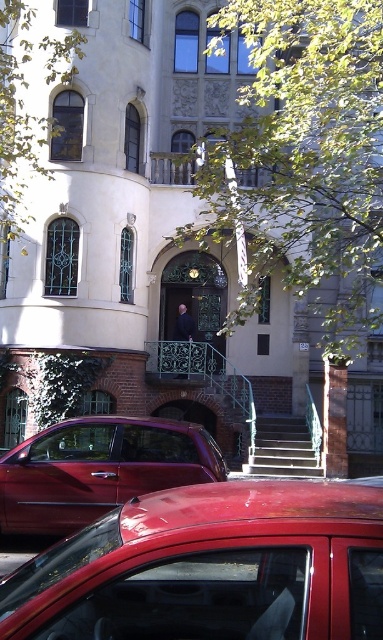
Is shiny metallic car at lower left wider than metallic gray stairs at center?

Yes, shiny metallic car at lower left is wider than metallic gray stairs at center.

Who is taller, shiny metallic car at lower left or metallic gray stairs at center?

Standing taller between the two is shiny metallic car at lower left.

Is point (86, 516) farther from camera compared to point (288, 458)?

No.

I want to click on shiny metallic car at lower left, so click(98, 468).

Describe the element at coordinates (98, 468) in the screenshot. I see `shiny metallic car at lower left` at that location.

Between point (106, 449) and point (180, 369), which one is positioned behind?

Point (180, 369)

The width and height of the screenshot is (383, 640). In order to click on shiny metallic car at lower left in this screenshot , I will do `click(98, 468)`.

Who is more distant from viewer, [248,467] or [184,374]?

Point [184,374]

Based on the photo, does metallic gray stairs at center appear under smooth black suit at center?

Yes, metallic gray stairs at center is below smooth black suit at center.

Image resolution: width=383 pixels, height=640 pixels. Identify the location of metallic gray stairs at center. (281, 449).